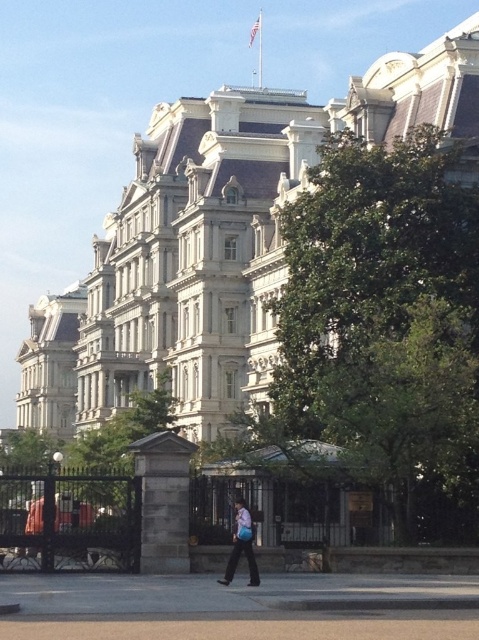
Question: Which of the following is the closest to the observer?

Choices:
 (A) gray concrete pavement at lower center
 (B) light blue fabric bag at center
 (C) white stone building at center

Answer: (A)

Question: Does white stone building at center lie behind gray concrete pavement at lower center?

Choices:
 (A) no
 (B) yes

Answer: (B)

Question: Can you confirm if white stone building at center is smaller than light blue fabric bag at center?

Choices:
 (A) yes
 (B) no

Answer: (B)

Question: Which point appears farthest from the camera in this image?

Choices:
 (A) (75, 320)
 (B) (84, 604)

Answer: (A)

Question: Which of the following is the farthest from the observer?

Choices:
 (A) gray concrete pavement at lower center
 (B) light blue fabric bag at center
 (C) white stone building at center

Answer: (C)

Question: Can you confirm if gray concrete pavement at lower center is positioned below light blue fabric bag at center?

Choices:
 (A) no
 (B) yes

Answer: (B)